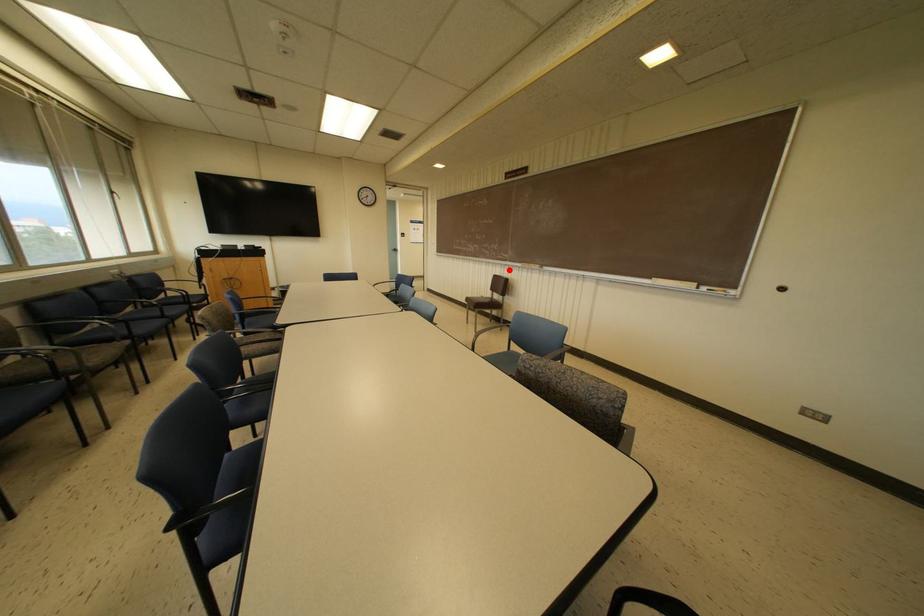
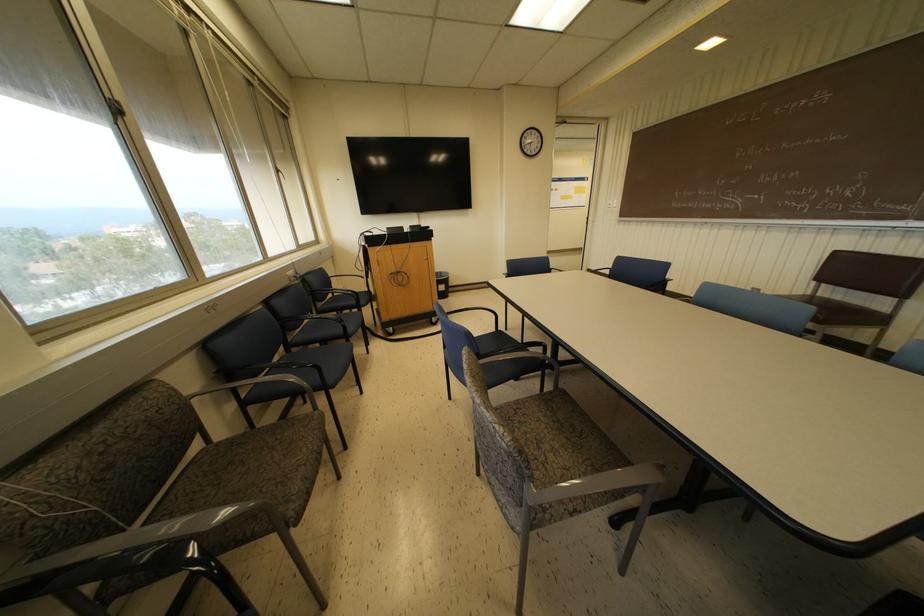
Locate, in the second image, the point that corresponds to the highlighted location in the first image.

(914, 240)